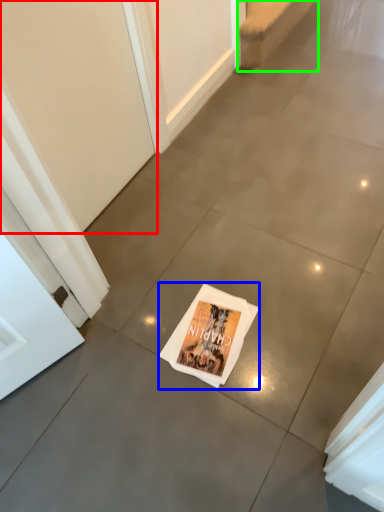
Question: Estimate the real-world distances between objects in this image. Which object is closer to screen door (highlighted by a red box), magazine (highlighted by a blue box) or stairwell (highlighted by a green box)?

Choices:
 (A) magazine
 (B) stairwell

Answer: (A)